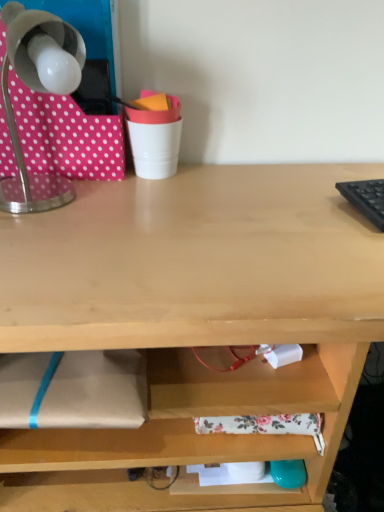
Question: Is metallic gray lamp at upper left situated inside pink polka dot fabric at upper left or outside?

Choices:
 (A) outside
 (B) inside

Answer: (A)

Question: Relative to pink polka dot fabric at upper left, is metallic gray lamp at upper left in front or behind?

Choices:
 (A) front
 (B) behind

Answer: (A)

Question: Based on their relative distances, which object is farther from the metallic gray lamp at upper left?

Choices:
 (A) pink polka dot fabric at upper left
 (B) white plastic cup at upper center

Answer: (B)

Question: Which of these objects is positioned farthest from the metallic gray lamp at upper left?

Choices:
 (A) white plastic cup at upper center
 (B) pink polka dot fabric at upper left

Answer: (A)